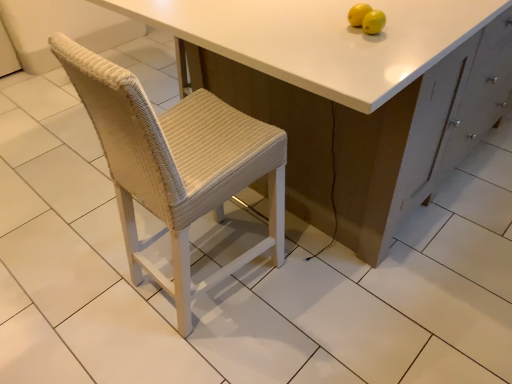
Image resolution: width=512 pixels, height=384 pixels. Identify the location of unoccupied region to the right of yellow matte lemons at upper right. (414, 29).